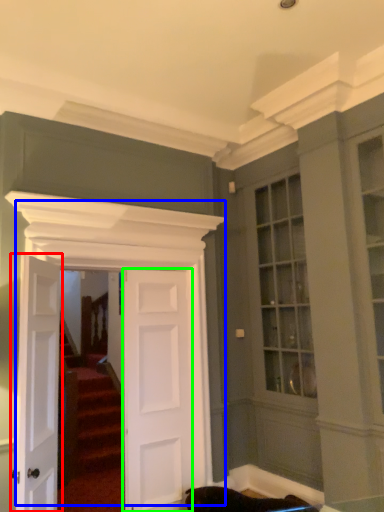
Question: Which object is the closest to the door (highlighted by a red box)? Choose among these: door (highlighted by a blue box) or door (highlighted by a green box).

Choices:
 (A) door
 (B) door

Answer: (A)